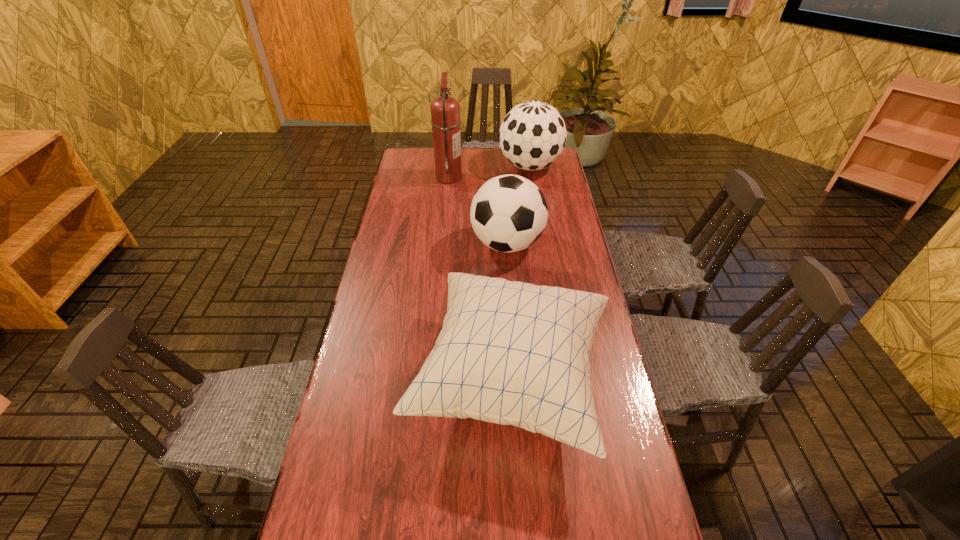
Where is `cushion positioned at the right edge`? cushion positioned at the right edge is located at coordinates (512, 353).

Locate an element on the screen. The width and height of the screenshot is (960, 540). object situated at the far right corner is located at coordinates (532, 136).

This screenshot has height=540, width=960. I want to click on vacant space at the left edge of the desktop, so click(x=372, y=537).

This screenshot has width=960, height=540. I want to click on vacant space at the right edge of the desktop, so click(563, 218).

At what (x,y) coordinates should I click in order to perform the action: click on free space at the far right corner. Please return your answer as a coordinate pair (x, y). Looking at the image, I should click on (546, 170).

Identify the location of free spot between the nearest object and the farther soccer ball. This screenshot has height=540, width=960. (520, 273).

This screenshot has height=540, width=960. What are the coordinates of `object that can be found as the closest to the nearest object` in the screenshot? It's located at (508, 213).

You are a GUI agent. You are given a task and a screenshot of the screen. Output one action in this format:
    pyautogui.click(x=<x>, y=<y>)
    Task: Click on the object that stands as the closest to the tallest object
    Image resolution: width=960 pixels, height=540 pixels.
    Given the screenshot: What is the action you would take?
    pyautogui.click(x=532, y=136)

This screenshot has width=960, height=540. What are the coordinates of `free spot that satisfies the following two spatial constraints: 1. on the front side of the farther soccer ball; 2. on the front-facing side of the fire extinguisher` in the screenshot? It's located at (532, 177).

Identify the location of vacant position in the image that satisfies the following two spatial constraints: 1. on the front-facing side of the fire extinguisher; 2. on the right side of the third farthest object. This screenshot has height=540, width=960. (443, 244).